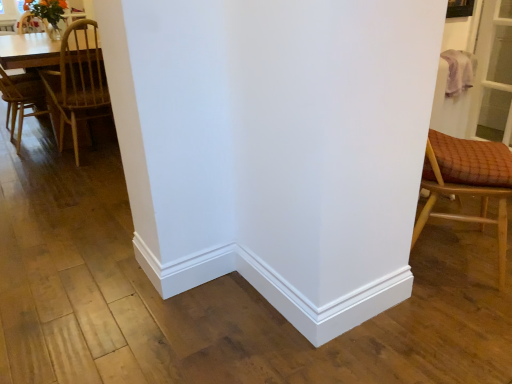
Question: Can you confirm if wooden checkered cushion at right, which is counted as the first chair, starting from the front, is shorter than light brown wooden table at left?

Choices:
 (A) yes
 (B) no

Answer: (B)

Question: Is wooden checkered cushion at right, which is counted as the first chair, starting from the front, in front of light brown wooden table at left?

Choices:
 (A) no
 (B) yes

Answer: (B)

Question: Is there a large distance between wooden checkered cushion at right, which is counted as the first chair, starting from the front, and light brown wooden table at left?

Choices:
 (A) no
 (B) yes

Answer: (B)

Question: From a real-world perspective, is wooden checkered cushion at right, the 1th chair in the right-to-left sequence, physically below light brown wooden table at left?

Choices:
 (A) no
 (B) yes

Answer: (A)

Question: Considering the relative sizes of wooden checkered cushion at right, the 1th chair in the right-to-left sequence, and light brown wooden table at left in the image provided, is wooden checkered cushion at right, the 1th chair in the right-to-left sequence, taller than light brown wooden table at left?

Choices:
 (A) no
 (B) yes

Answer: (B)

Question: Relative to light brown wooden table at left, is wooden checkered cushion at right, which is counted as the first chair, starting from the front, in front or behind?

Choices:
 (A) behind
 (B) front

Answer: (B)

Question: In terms of height, does wooden checkered cushion at right, marked as the second chair in a left-to-right arrangement, look taller or shorter compared to light brown wooden table at left?

Choices:
 (A) short
 (B) tall

Answer: (B)

Question: From the image's perspective, is wooden checkered cushion at right, the 1th chair in the right-to-left sequence, positioned above or below light brown wooden table at left?

Choices:
 (A) below
 (B) above

Answer: (A)

Question: In the image, is wooden checkered cushion at right, the 1th chair in the right-to-left sequence, on the left side or the right side of light brown wooden table at left?

Choices:
 (A) left
 (B) right

Answer: (B)

Question: Would you say wooden chair at left, positioned as the 1th chair in left-to-right order, is to the left or to the right of light brown wooden table at left in the picture?

Choices:
 (A) left
 (B) right

Answer: (B)

Question: Relative to light brown wooden table at left, is wooden chair at left, positioned as the 1th chair in left-to-right order, in front or behind?

Choices:
 (A) front
 (B) behind

Answer: (A)

Question: Would you say wooden chair at left, placed as the 2th chair when sorted from front to back, is inside or outside light brown wooden table at left?

Choices:
 (A) outside
 (B) inside

Answer: (A)

Question: Is wooden chair at left, marked as the first chair in a back-to-front arrangement, taller or shorter than light brown wooden table at left?

Choices:
 (A) short
 (B) tall

Answer: (B)

Question: Considering the positions of light brown wooden table at left and wooden chair at left, marked as the first chair in a back-to-front arrangement, in the image, is light brown wooden table at left taller or shorter than wooden chair at left, marked as the first chair in a back-to-front arrangement,?

Choices:
 (A) tall
 (B) short

Answer: (B)

Question: From the image's perspective, is light brown wooden table at left located above or below wooden chair at left, positioned as the 1th chair in left-to-right order?

Choices:
 (A) below
 (B) above

Answer: (B)